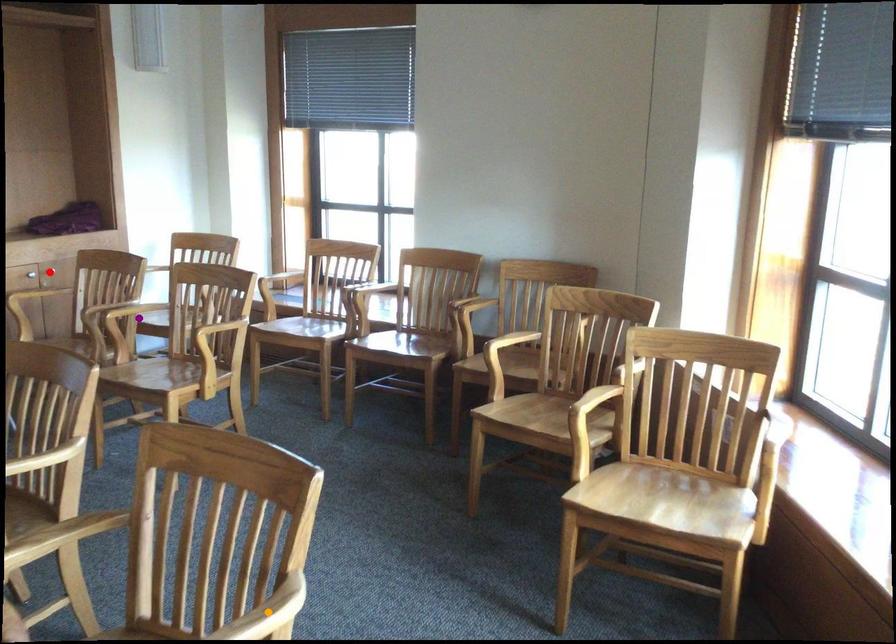
Order these from nearest to farthest:
A) purple point
B) orange point
C) red point

1. red point
2. purple point
3. orange point